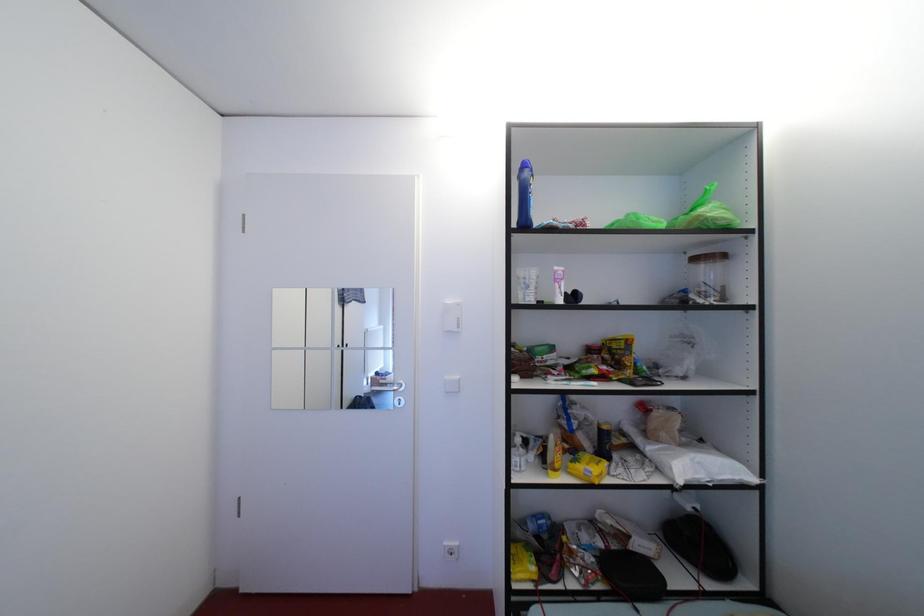
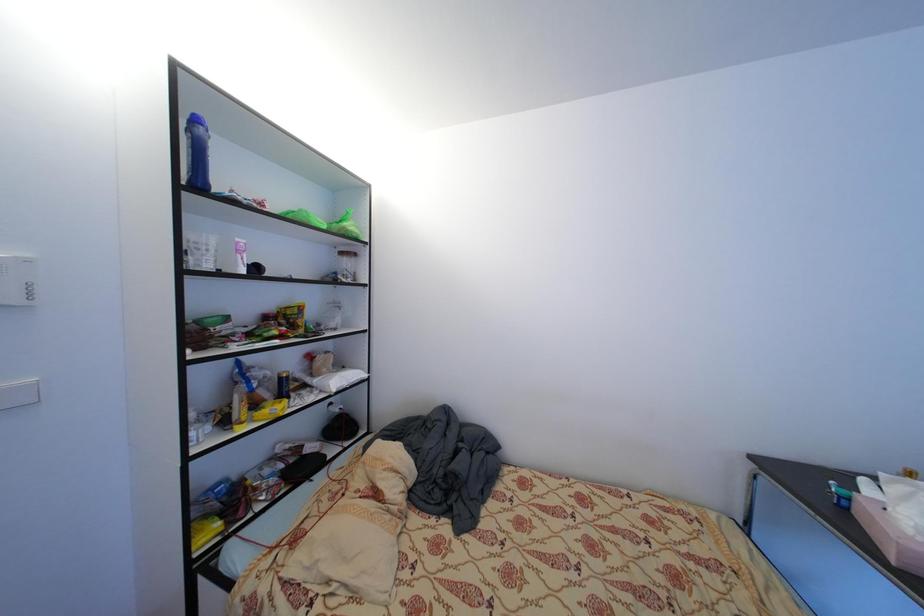
Question: How did the camera likely rotate?

Choices:
 (A) Left
 (B) Right
 (C) Up
 (D) Down

Answer: (B)